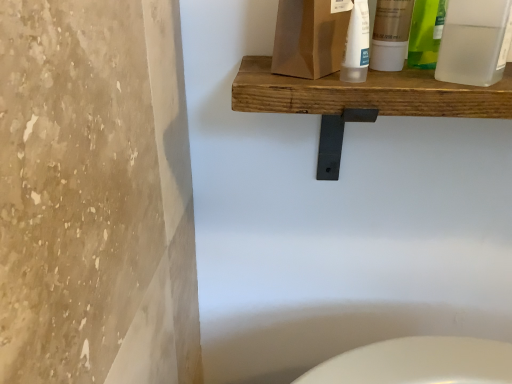
Question: From a real-world perspective, is wooden shelf at upper center on translucent plastic tube at upper center, marked as the first cleaning product in a right-to-left arrangement?

Choices:
 (A) no
 (B) yes

Answer: (A)

Question: Considering the relative sizes of wooden shelf at upper center and translucent plastic tube at upper center, the second cleaning product when ordered from left to right, in the image provided, is wooden shelf at upper center taller than translucent plastic tube at upper center, the second cleaning product when ordered from left to right,?

Choices:
 (A) yes
 (B) no

Answer: (A)

Question: Is wooden shelf at upper center to the left of translucent plastic tube at upper center, the second cleaning product when ordered from left to right, from the viewer's perspective?

Choices:
 (A) no
 (B) yes

Answer: (A)

Question: Is wooden shelf at upper center beside translucent plastic tube at upper center, the second cleaning product when ordered from left to right?

Choices:
 (A) yes
 (B) no

Answer: (A)

Question: Is the depth of wooden shelf at upper center less than that of translucent plastic tube at upper center, marked as the first cleaning product in a right-to-left arrangement?

Choices:
 (A) yes
 (B) no

Answer: (A)

Question: Is translucent plastic bottle at upper center, which ranks as the first cleaning product in left-to-right order, in front of or behind transparent plastic bottle at upper right, which appears as the 2th mouthwash when viewed from the left, in the image?

Choices:
 (A) behind
 (B) front

Answer: (A)

Question: Would you say translucent plastic bottle at upper center, which ranks as the first cleaning product in left-to-right order, is inside or outside transparent plastic bottle at upper right, which appears as the 2th mouthwash when viewed from the left?

Choices:
 (A) inside
 (B) outside

Answer: (B)

Question: From a real-world perspective, relative to transparent plastic bottle at upper right, acting as the 1th mouthwash starting from the right, is translucent plastic bottle at upper center, the second cleaning product positioned from the right, vertically above or below?

Choices:
 (A) below
 (B) above

Answer: (B)

Question: Is translucent plastic bottle at upper center, which ranks as the first cleaning product in left-to-right order, bigger or smaller than transparent plastic bottle at upper right, acting as the 1th mouthwash starting from the right?

Choices:
 (A) small
 (B) big

Answer: (B)

Question: Looking at the image, does translucent plastic tube at upper center, the second cleaning product when ordered from left to right, seem bigger or smaller compared to transparent plastic bottle at upper right, acting as the 1th mouthwash starting from the right?

Choices:
 (A) small
 (B) big

Answer: (A)

Question: Is translucent plastic tube at upper center, the second cleaning product when ordered from left to right, in front of or behind transparent plastic bottle at upper right, which appears as the 2th mouthwash when viewed from the left, in the image?

Choices:
 (A) behind
 (B) front

Answer: (A)

Question: Does point click(x=356, y=14) appear closer or farther from the camera than point click(x=453, y=1)?

Choices:
 (A) farther
 (B) closer

Answer: (B)

Question: From the image's perspective, relative to transparent plastic bottle at upper right, which appears as the 2th mouthwash when viewed from the left, is translucent plastic tube at upper center, the second cleaning product when ordered from left to right, above or below?

Choices:
 (A) above
 (B) below

Answer: (B)

Question: From a real-world perspective, relative to translucent plastic tube at upper center, marked as the first cleaning product in a right-to-left arrangement, is wooden shelf at upper center vertically above or below?

Choices:
 (A) above
 (B) below

Answer: (B)

Question: Which is correct: wooden shelf at upper center is inside translucent plastic tube at upper center, the second cleaning product when ordered from left to right, or outside of it?

Choices:
 (A) outside
 (B) inside

Answer: (A)